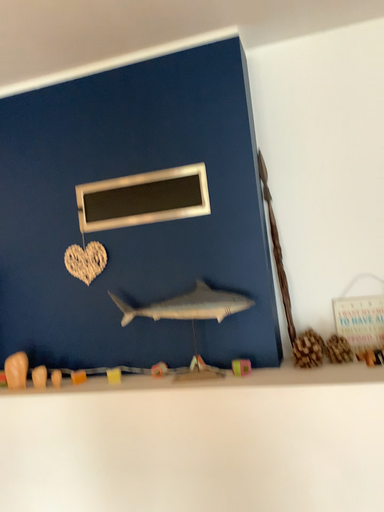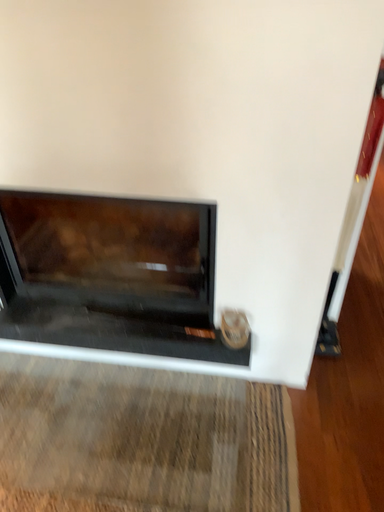
Question: Which way did the camera rotate in the video?

Choices:
 (A) rotated right
 (B) rotated left

Answer: (A)